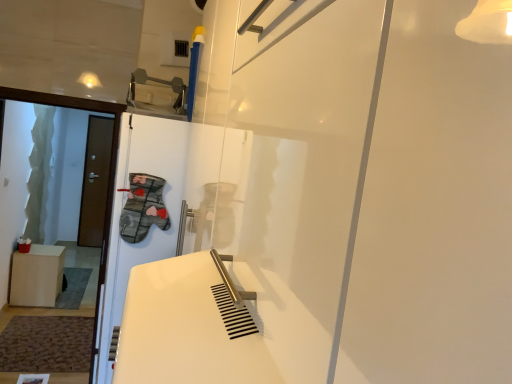
Question: Is white matte screen door at center completely or partially inside light brown wooden cabinet at left?

Choices:
 (A) no
 (B) yes

Answer: (A)

Question: From a real-world perspective, is light brown wooden cabinet at left physically above white matte screen door at center?

Choices:
 (A) no
 (B) yes

Answer: (A)

Question: Does light brown wooden cabinet at left have a lesser height compared to white matte screen door at center?

Choices:
 (A) no
 (B) yes

Answer: (B)

Question: From the image's perspective, would you say light brown wooden cabinet at left is positioned over white matte screen door at center?

Choices:
 (A) no
 (B) yes

Answer: (A)

Question: From the image's perspective, is light brown wooden cabinet at left located beneath white matte screen door at center?

Choices:
 (A) yes
 (B) no

Answer: (A)

Question: Considering the positions of brown matte door at left and light brown wooden cabinet at left in the image, is brown matte door at left bigger or smaller than light brown wooden cabinet at left?

Choices:
 (A) big
 (B) small

Answer: (B)

Question: Would you say brown matte door at left is inside or outside light brown wooden cabinet at left?

Choices:
 (A) outside
 (B) inside

Answer: (A)

Question: Visually, is brown matte door at left positioned to the left or to the right of light brown wooden cabinet at left?

Choices:
 (A) right
 (B) left

Answer: (B)

Question: From the image's perspective, is brown matte door at left located above or below light brown wooden cabinet at left?

Choices:
 (A) above
 (B) below

Answer: (A)

Question: Based on their sizes in the image, would you say brown matte door at left is bigger or smaller than white matte screen door at center?

Choices:
 (A) small
 (B) big

Answer: (A)

Question: From a real-world perspective, is brown matte door at left physically located above or below white matte screen door at center?

Choices:
 (A) above
 (B) below

Answer: (B)

Question: In terms of width, does brown matte door at left look wider or thinner when compared to white matte screen door at center?

Choices:
 (A) thin
 (B) wide

Answer: (A)

Question: Does point (93, 140) appear closer or farther from the camera than point (152, 162)?

Choices:
 (A) farther
 (B) closer

Answer: (A)

Question: Based on their positions, is white matte screen door at center located to the left or right of light brown wooden cabinet at left?

Choices:
 (A) left
 (B) right

Answer: (B)

Question: Choose the correct answer: Is white matte screen door at center inside light brown wooden cabinet at left or outside it?

Choices:
 (A) inside
 (B) outside

Answer: (B)